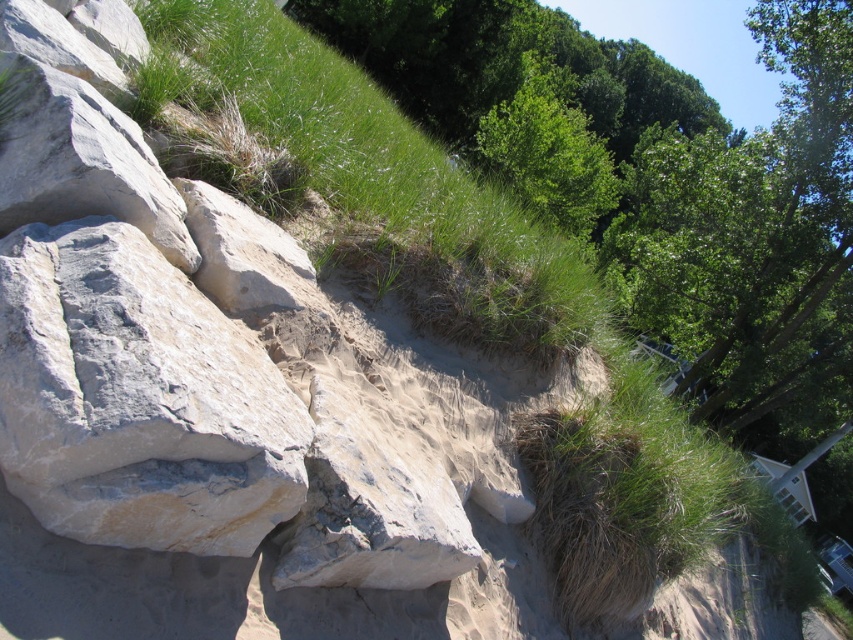
Question: Can you confirm if beige/rough rock at left is positioned below green leafy tree at upper center?

Choices:
 (A) yes
 (B) no

Answer: (A)

Question: Which point is farther to the camera?

Choices:
 (A) green leafy tree at upper center
 (B) beige/rough rock at left

Answer: (A)

Question: Is beige/rough rock at left wider than green leafy tree at upper center?

Choices:
 (A) no
 (B) yes

Answer: (A)

Question: Where is beige/rough rock at left located in relation to green leafy tree at upper center in the image?

Choices:
 (A) right
 (B) left

Answer: (B)